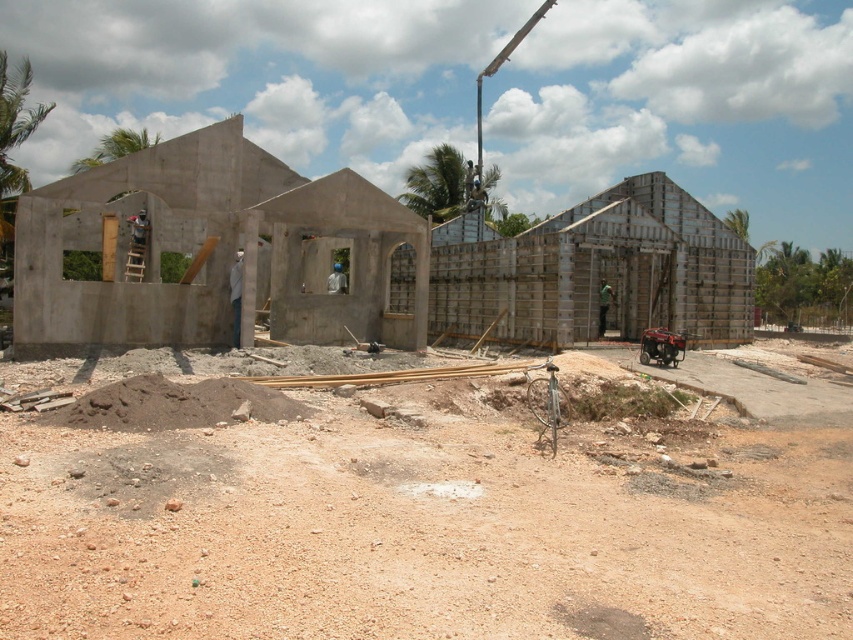
Is brown gravel at lower center wider than green fabric construction worker at center?

Indeed, brown gravel at lower center has a greater width compared to green fabric construction worker at center.

Measure the distance from brown gravel at lower center to green fabric construction worker at center.

brown gravel at lower center is 13.60 meters away from green fabric construction worker at center.

Locate an element on the screen. Image resolution: width=853 pixels, height=640 pixels. brown gravel at lower center is located at coordinates (426, 524).

Where is `brown gravel at lower center`? This screenshot has width=853, height=640. brown gravel at lower center is located at coordinates (426, 524).

Can you confirm if brown gravel at lower center is wider than smooth concrete building at center?

No.

Find the location of `brown gravel at lower center`. brown gravel at lower center is located at coordinates (426, 524).

Does point (724, 307) come in front of point (596, 336)?

No, (724, 307) is behind (596, 336).

What do you see at coordinates (358, 259) in the screenshot?
I see `smooth concrete building at center` at bounding box center [358, 259].

This screenshot has height=640, width=853. In order to click on smooth concrete building at center in this screenshot , I will do `click(358, 259)`.